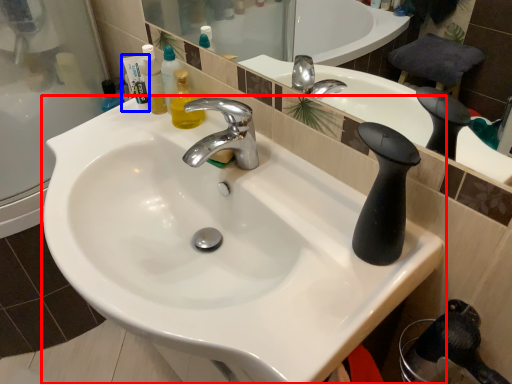
Question: Which of the following is the farthest to the observer, sink (highlighted by a red box) or toiletry (highlighted by a blue box)?

Choices:
 (A) sink
 (B) toiletry

Answer: (B)